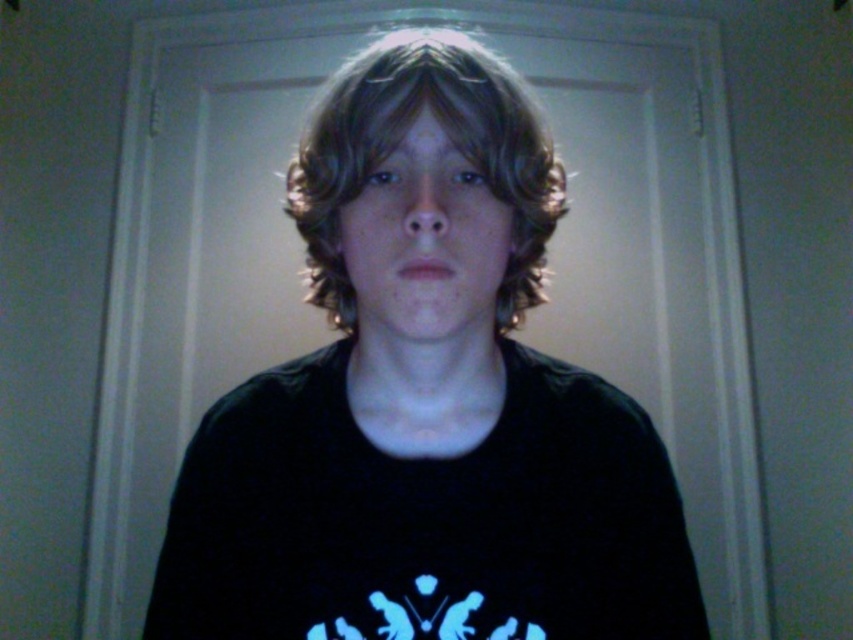
Question: Which object is the closest to the brown wavy hair at center?

Choices:
 (A) black matte shirt at center
 (B) black matte t-shirt at center

Answer: (B)

Question: Which point is closer to the camera taking this photo?

Choices:
 (A) (556, 490)
 (B) (643, 448)

Answer: (A)

Question: Is black matte shirt at center below black matte t-shirt at center?

Choices:
 (A) yes
 (B) no

Answer: (B)

Question: Which point appears closest to the camera in this image?

Choices:
 (A) (392, 464)
 (B) (374, 182)
 (C) (552, 156)

Answer: (B)

Question: Is black matte shirt at center closer to camera compared to brown wavy hair at center?

Choices:
 (A) no
 (B) yes

Answer: (A)

Question: Can you confirm if black matte t-shirt at center is positioned above brown wavy hair at center?

Choices:
 (A) yes
 (B) no

Answer: (B)